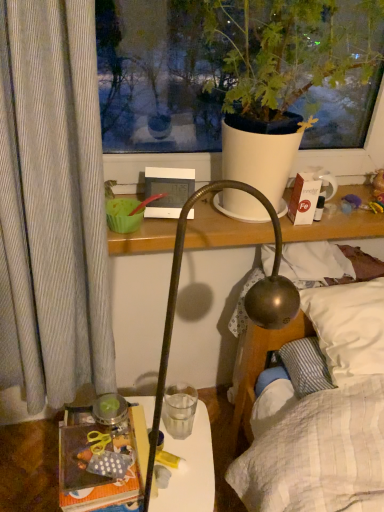
What do you see at coordinates (101, 461) in the screenshot? I see `polka dot fabric book at lower left` at bounding box center [101, 461].

What do you see at coordinates (348, 328) in the screenshot?
I see `white soft pillow at upper right` at bounding box center [348, 328].

Describe the element at coordinates (290, 51) in the screenshot. I see `white matte pot at upper center` at that location.

The image size is (384, 512). What do you see at coordinates (179, 410) in the screenshot?
I see `transparent glass at center` at bounding box center [179, 410].

Identify the location of polka dot fabric book at lower left. (101, 461).

Considering the relative sizes of white cardboard box at upper right and polka dot fabric book at lower left in the image provided, is white cardboard box at upper right smaller than polka dot fabric book at lower left?

Yes.

Is point (306, 221) in front of point (102, 428)?

No, it is not.

From a real-world perspective, does white cardboard box at upper right sit lower than polka dot fabric book at lower left?

Incorrect, from a real-world perspective, white cardboard box at upper right is higher than polka dot fabric book at lower left.

Is white cardboard box at upper right positioned with its back to polka dot fabric book at lower left?

No, white cardboard box at upper right is not facing the opposite direction of polka dot fabric book at lower left.

From a real-world perspective, between white matte pot at upper center and transparent glass at center, who is vertically higher?

white matte pot at upper center is physically above.

Is white matte pot at upper center in front of transparent glass at center?

Yes.

Is white matte pot at upper center in contact with transparent glass at center?

No, white matte pot at upper center is not touching transparent glass at center.

Is point (347, 74) positioned before point (175, 419)?

Yes, point (347, 74) is closer to viewer.

Is translucent plastic table at lower left oriented towards white matte pot at upper center?

No, translucent plastic table at lower left is not oriented towards white matte pot at upper center.

Does translucent plastic table at lower left have a greater height compared to white matte pot at upper center?

No.

Is translucent plastic table at lower left further to camera compared to white matte pot at upper center?

Yes, it is.

Is translucent plastic table at lower left outside of white matte pot at upper center?

That's correct, translucent plastic table at lower left is outside of white matte pot at upper center.

Is white cardboard box at upper right wider or thinner than translucent plastic table at lower left?

In the image, white cardboard box at upper right appears to be more narrow than translucent plastic table at lower left.

In the image, is white cardboard box at upper right on the left side or the right side of translucent plastic table at lower left?

From the image, it's evident that white cardboard box at upper right is to the right of translucent plastic table at lower left.

In the scene shown: Does white cardboard box at upper right have a lesser height compared to translucent plastic table at lower left?

Indeed, white cardboard box at upper right has a lesser height compared to translucent plastic table at lower left.

Is white cardboard box at upper right outside of translucent plastic table at lower left?

Yes, white cardboard box at upper right is located beyond the bounds of translucent plastic table at lower left.

Is transparent glass at center facing away from white cardboard box at upper right?

No, transparent glass at center's orientation is not away from white cardboard box at upper right.

Between transparent glass at center and white cardboard box at upper right, which one appears on the left side from the viewer's perspective?

Positioned to the left is transparent glass at center.

Which point is more forward, (193,397) or (297,199)?

Point (297,199)

From the image's perspective, is transparent glass at center positioned above or below white cardboard box at upper right?

Clearly, from the image's perspective, transparent glass at center is below white cardboard box at upper right.

Relative to white soft pillow at upper right, is translucent plastic table at lower left in front or behind?

translucent plastic table at lower left is in front of white soft pillow at upper right.

From the image's perspective, which is below, translucent plastic table at lower left or white soft pillow at upper right?

translucent plastic table at lower left, from the image's perspective.

Choose the correct answer: Is translucent plastic table at lower left inside white soft pillow at upper right or outside it?

translucent plastic table at lower left is not enclosed by white soft pillow at upper right.

Does translucent plastic table at lower left have a larger size compared to white soft pillow at upper right?

Indeed, translucent plastic table at lower left has a larger size compared to white soft pillow at upper right.

Is polka dot fabric book at lower left positioned with its back to white soft pillow at upper right?

No, polka dot fabric book at lower left is not facing the opposite direction of white soft pillow at upper right.

Would you say polka dot fabric book at lower left is to the left or to the right of white soft pillow at upper right in the picture?

polka dot fabric book at lower left is to the left of white soft pillow at upper right.

Find the location of a particular element. book that appears on the left of white soft pillow at upper right is located at coordinates (101, 461).

Where is `book that appears below the white cardboard box at upper right (from a real-world perspective)`? The image size is (384, 512). book that appears below the white cardboard box at upper right (from a real-world perspective) is located at coordinates (101, 461).

At what (x,y) coordinates should I click in order to perform the action: click on houseplant that appears in front of the transparent glass at center. Please return your answer as a coordinate pair (x, y). Looking at the image, I should click on (290, 51).

From the image, which object appears to be nearer to white soft pillow at upper right, white cardboard box at upper right or polka dot fabric book at lower left?

white cardboard box at upper right lies closer to white soft pillow at upper right than the other object.

When comparing their distances from white matte pot at upper center, does white cardboard box at upper right or transparent glass at center seem closer?

Based on the image, white cardboard box at upper right appears to be nearer to white matte pot at upper center.

Considering their positions, is translucent plastic table at lower left positioned further to transparent glass at center than white soft pillow at upper right?

white soft pillow at upper right.

From the image, which object appears to be farther from translucent plastic table at lower left, polka dot fabric book at lower left or white soft pillow at upper right?

white soft pillow at upper right.

From the image, which object appears to be farther from white cardboard box at upper right, translucent plastic table at lower left or transparent glass at center?

Among the two, translucent plastic table at lower left is located further to white cardboard box at upper right.

Estimate the real-world distances between objects in this image. Which object is closer to white soft pillow at upper right, white matte pot at upper center or white cardboard box at upper right?

The object closer to white soft pillow at upper right is white cardboard box at upper right.

Looking at the image, which one is located closer to translucent plastic table at lower left, transparent glass at center or white soft pillow at upper right?

transparent glass at center is closer to translucent plastic table at lower left.

Looking at the image, which one is located further to white soft pillow at upper right, white cardboard box at upper right or white matte pot at upper center?

white matte pot at upper center is positioned further to the anchor white soft pillow at upper right.

This screenshot has height=512, width=384. Find the location of `pillow that lies between white cardboard box at upper right and transparent glass at center from top to bottom`. pillow that lies between white cardboard box at upper right and transparent glass at center from top to bottom is located at coordinates (348, 328).

At what (x,y) coordinates should I click in order to perform the action: click on table located between polka dot fabric book at lower left and white soft pillow at upper right in the left-right direction. Please return your answer as a coordinate pair (x, y). This screenshot has height=512, width=384. Looking at the image, I should click on (29, 467).

Where is `box that lies between white matte pot at upper center and transparent glass at center from top to bottom`? This screenshot has height=512, width=384. box that lies between white matte pot at upper center and transparent glass at center from top to bottom is located at coordinates (304, 198).

You are a GUI agent. You are given a task and a screenshot of the screen. Output one action in this format:
    pyautogui.click(x=<x>, y=<y>)
    Task: Click on the book between white cardboard box at upper right and translucent plastic table at lower left vertically
    
    Given the screenshot: What is the action you would take?
    pyautogui.click(x=101, y=461)